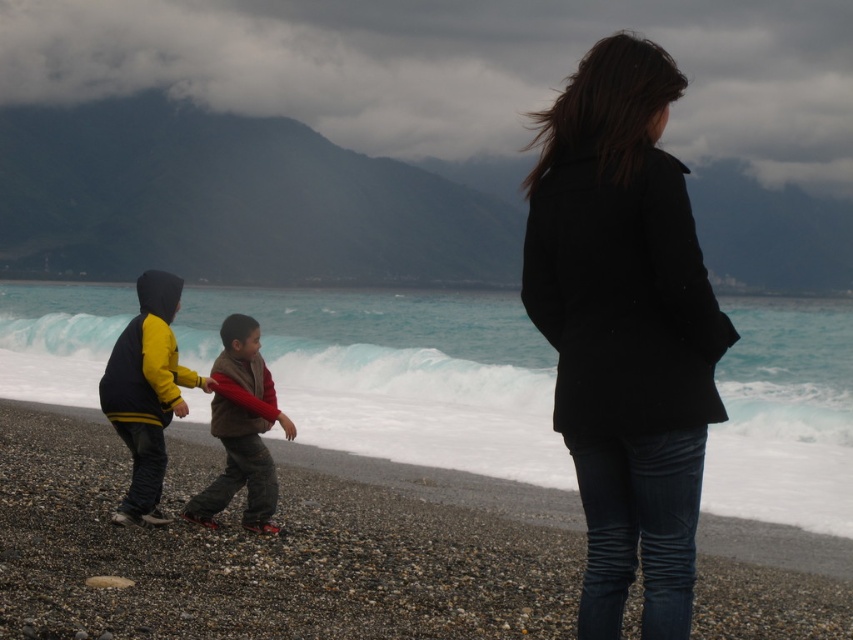
You are a photographer standing at the edge of the beach. You want to take a photo that includes both the point at coordinates point (529, 115) and point (131, 467). Which point will appear closer to the bottom edge of your camera viewfinder?

Point (131, 467) will appear closer to the bottom edge of the camera viewfinder because it is closer to the camera than point (529, 115).

In the scene shown: You are a photographer standing on the beach and want to take a photo of the two points marked in the scene. Which point, point (700, 552) or point (685, 564), is closer to your camera position?

Point (685, 564) is closer to the camera because it is less further than point (700, 552).

In the scene shown: You are a photographer standing at the edge of the beach. You want to take a photo of the black matte coat at center. Where should you position your camera to capture it in the frame?

To capture the black matte coat at center, position your camera at the center of the beach since the black matte coat at center is located at point (624, 328) which is near the center of the image.